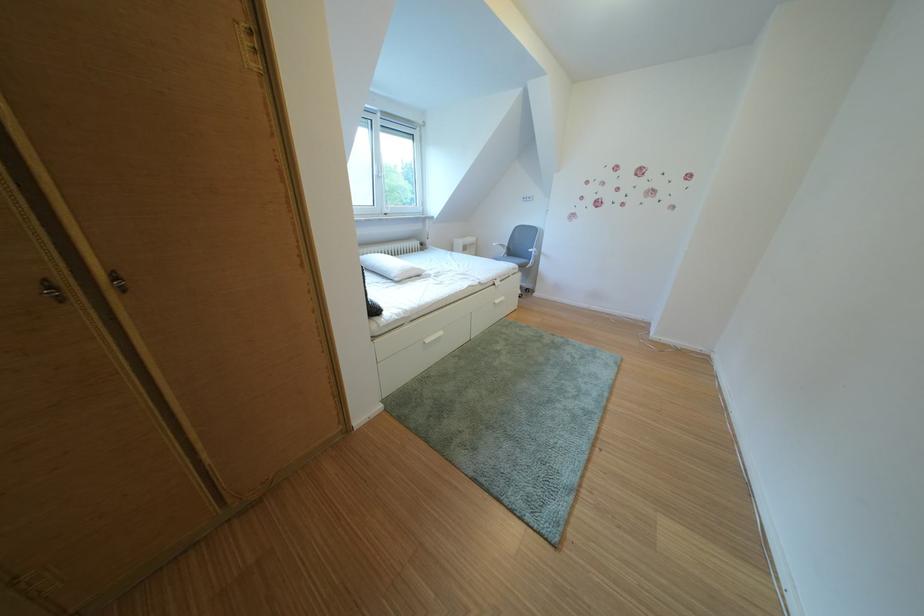
Where would you sit the chair sitting surface? Please return your answer as a coordinate pair (x, y).

(514, 257)